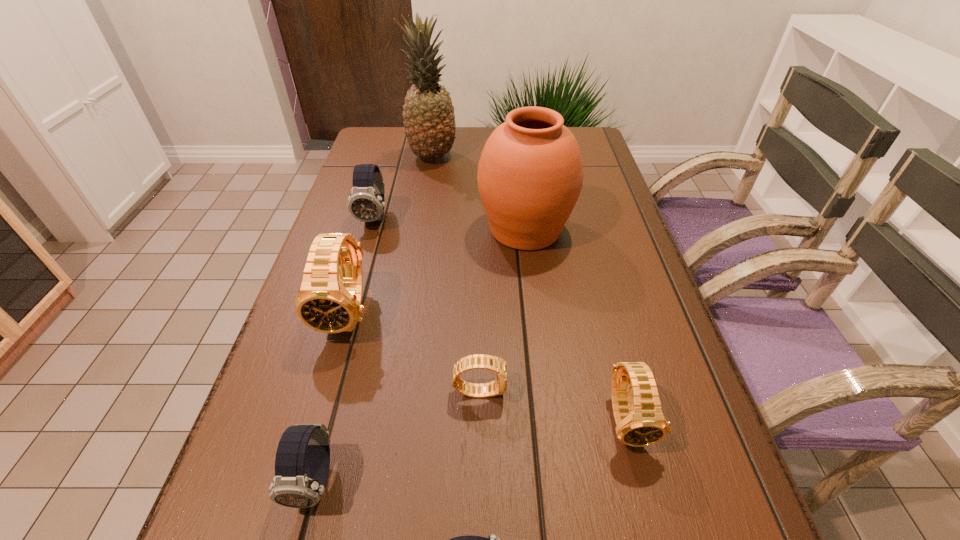
You are a GUI agent. You are given a task and a screenshot of the screen. Output one action in this format:
    pyautogui.click(x=<x>, y=<y>)
    Task: Click on the smallest black watch
    The width and height of the screenshot is (960, 540).
    Given the screenshot: What is the action you would take?
    pyautogui.click(x=477, y=361)

Find the location of a particular element. The image size is (960, 540). vacant space located on the right of the farthest object is located at coordinates (581, 157).

Find the location of a particular element. The height and width of the screenshot is (540, 960). vacant space located on the back of the second tallest object is located at coordinates (516, 148).

Where is `free point located 0.090m on the face of the leftmost black watch`? This screenshot has height=540, width=960. free point located 0.090m on the face of the leftmost black watch is located at coordinates 327,389.

Locate an element on the screen. Image resolution: width=960 pixels, height=540 pixels. vacant region located on the face of the biggest dark watch is located at coordinates (354, 293).

Image resolution: width=960 pixels, height=540 pixels. In order to click on free space located 0.110m on the face of the rightmost black watch in this screenshot , I will do `click(657, 534)`.

At what (x,y) coordinates should I click in order to perform the action: click on blank space located 0.270m on the face of the smallest black watch. Please return your answer as a coordinate pair (x, y). The height and width of the screenshot is (540, 960). Looking at the image, I should click on (660, 390).

What are the coordinates of `object that is at the far edge` in the screenshot? It's located at (429, 120).

This screenshot has width=960, height=540. Find the location of `pineapple present at the left edge`. pineapple present at the left edge is located at coordinates (429, 120).

Locate an element on the screen. This screenshot has height=540, width=960. urn that is at the right edge is located at coordinates (530, 174).